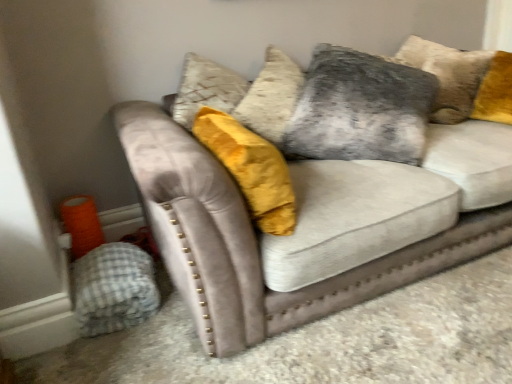
Measure the distance between point (354,54) and camera.

Point (354,54) and camera are 6.28 feet apart.

Describe the element at coordinates (360, 109) in the screenshot. I see `velvet gray pillow at upper center` at that location.

The width and height of the screenshot is (512, 384). Identify the location of gray checkered blanket at lower left. (114, 288).

How different are the orientations of velvet gray couch at center and gray checkered blanket at lower left in degrees?

There is a 90-degree angle between the facing directions of velvet gray couch at center and gray checkered blanket at lower left.

Would you say gray checkered blanket at lower left is part of velvet gray couch at center's contents?

Actually, gray checkered blanket at lower left is outside velvet gray couch at center.

Which object is thinner, velvet gray couch at center or gray checkered blanket at lower left?

Thinner between the two is gray checkered blanket at lower left.

From a real-world perspective, is velvet gray couch at center on top of gray checkered blanket at lower left?

Yes, from a real-world perspective, velvet gray couch at center is on top of gray checkered blanket at lower left.

Would you say velvet gray couch at center is outside velvet gray pillow at upper center?

Indeed, velvet gray couch at center is completely outside velvet gray pillow at upper center.

Is velvet gray couch at center positioned with its back to velvet gray pillow at upper center?

Yes, velvet gray couch at center's orientation is away from velvet gray pillow at upper center.

Is velvet gray couch at center positioned in front of velvet gray pillow at upper center?

Yes, it is.

Based on their positions, is gray checkered blanket at lower left located to the left or right of velvet gray pillow at upper center?

In the image, gray checkered blanket at lower left appears on the left side of velvet gray pillow at upper center.

Considering the sizes of objects gray checkered blanket at lower left and velvet gray pillow at upper center in the image provided, who is bigger, gray checkered blanket at lower left or velvet gray pillow at upper center?

Bigger between the two is velvet gray pillow at upper center.

The height and width of the screenshot is (384, 512). Identify the location of material located underneath the velvet gray pillow at upper center (from a real-world perspective). (114, 288).

Is velvet gray pillow at upper center facing away from gray checkered blanket at lower left?

velvet gray pillow at upper center does not have its back to gray checkered blanket at lower left.

Where is `pillow behind the gray checkered blanket at lower left`? This screenshot has height=384, width=512. pillow behind the gray checkered blanket at lower left is located at coordinates (360, 109).

Considering the relative sizes of velvet gray pillow at upper center and gray checkered blanket at lower left in the image provided, is velvet gray pillow at upper center bigger than gray checkered blanket at lower left?

Correct, velvet gray pillow at upper center is larger in size than gray checkered blanket at lower left.

How different are the orientations of gray checkered blanket at lower left and velvet gray couch at center in degrees?

The facing directions of gray checkered blanket at lower left and velvet gray couch at center are 90 degrees apart.

Is gray checkered blanket at lower left oriented towards velvet gray couch at center?

Yes, gray checkered blanket at lower left is facing velvet gray couch at center.

Does gray checkered blanket at lower left have a greater width compared to velvet gray couch at center?

In fact, gray checkered blanket at lower left might be narrower than velvet gray couch at center.

From a real-world perspective, which is physically above, gray checkered blanket at lower left or velvet gray couch at center?

velvet gray couch at center.

From a real-world perspective, is velvet gray pillow at upper center under velvet gray couch at center?

No.

In the scene shown: Could you tell me if velvet gray pillow at upper center is facing velvet gray couch at center?

Yes, velvet gray pillow at upper center is facing velvet gray couch at center.

Is velvet gray pillow at upper center in front of velvet gray couch at center?

No, velvet gray pillow at upper center is behind velvet gray couch at center.

Would you say velvet gray pillow at upper center is to the left or to the right of velvet gray couch at center in the picture?

velvet gray pillow at upper center is positioned on velvet gray couch at center's right side.

This screenshot has width=512, height=384. Identify the location of studio couch above the gray checkered blanket at lower left (from a real-world perspective). (313, 224).

Where is `studio couch in front of the velvet gray pillow at upper center`? The image size is (512, 384). studio couch in front of the velvet gray pillow at upper center is located at coordinates (313, 224).

From the image, which object appears to be farther from velvet gray pillow at upper center, velvet gray couch at center or gray checkered blanket at lower left?

The object further to velvet gray pillow at upper center is gray checkered blanket at lower left.

Looking at the image, which one is located further to velvet gray couch at center, velvet gray pillow at upper center or gray checkered blanket at lower left?

Among the two, gray checkered blanket at lower left is located further to velvet gray couch at center.

Looking at the image, which one is located further to gray checkered blanket at lower left, velvet gray couch at center or velvet gray pillow at upper center?

velvet gray pillow at upper center is further to gray checkered blanket at lower left.

Considering their positions, is gray checkered blanket at lower left positioned closer to velvet gray couch at center than velvet gray pillow at upper center?

velvet gray pillow at upper center is positioned closer to the anchor velvet gray couch at center.

Looking at the image, which one is located further to velvet gray pillow at upper center, gray checkered blanket at lower left or velvet gray couch at center?

gray checkered blanket at lower left.

Estimate the real-world distances between objects in this image. Which object is closer to gray checkered blanket at lower left, velvet gray pillow at upper center or velvet gray couch at center?

velvet gray couch at center is closer to gray checkered blanket at lower left.

Find the location of a particular element. This screenshot has height=384, width=512. studio couch located between gray checkered blanket at lower left and velvet gray pillow at upper center in the left-right direction is located at coordinates (313, 224).